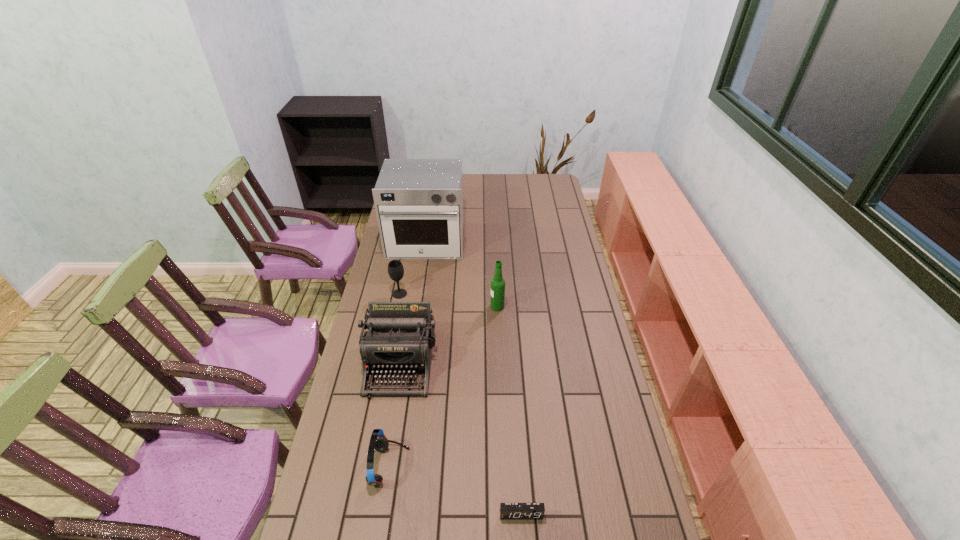
Where is `typewriter at the left edge`? typewriter at the left edge is located at coordinates (400, 338).

Where is `wineglass positioned at the left edge`? wineglass positioned at the left edge is located at coordinates (395, 268).

At what (x,y) coordinates should I click in order to perform the action: click on headset that is at the left edge. Please return your answer as a coordinate pair (x, y). Looking at the image, I should click on (378, 441).

Where is `free space at the left edge of the desktop`? The image size is (960, 540). free space at the left edge of the desktop is located at coordinates (373, 287).

Where is `vacant region at the right edge of the desktop`? The height and width of the screenshot is (540, 960). vacant region at the right edge of the desktop is located at coordinates (559, 329).

This screenshot has width=960, height=540. In order to click on vacant area that lies between the second shortest object and the second tallest object in this screenshot , I will do `click(444, 387)`.

Image resolution: width=960 pixels, height=540 pixels. I want to click on free space between the tallest object and the beer bottle, so click(x=462, y=274).

Where is `free area in between the toaster oven and the fourth nearest object`? The image size is (960, 540). free area in between the toaster oven and the fourth nearest object is located at coordinates (462, 274).

You are a GUI agent. You are given a task and a screenshot of the screen. Output one action in this format:
    pyautogui.click(x=<x>, y=<y>)
    Task: Click on the free space between the third farthest object and the tallest object
    This screenshot has width=960, height=540.
    Given the screenshot: What is the action you would take?
    pyautogui.click(x=462, y=274)

What are the coordinates of `vacant space in between the second shortest object and the fifth nearest object` in the screenshot? It's located at (395, 380).